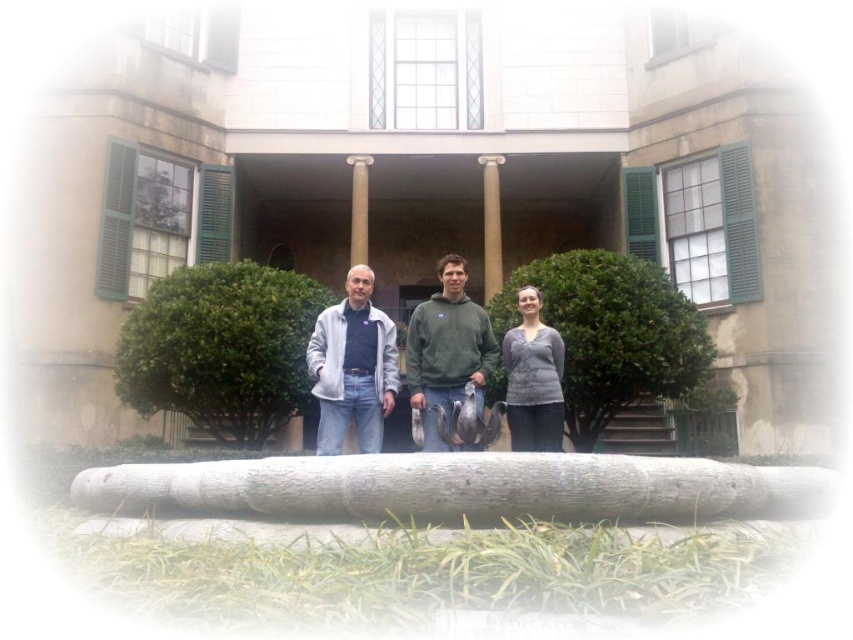
From the picture: You are standing in front of the two story classical building. You see a matte gray hoodie at center and a smooth tan column at center. Which object is closer to the ground?

The matte gray hoodie at center is below the smooth tan column at center, so the matte gray hoodie at center is closer to the ground.

You are a photographer setting up a shoot in front of the classical building. You have two subjects wearing the light gray fleece jacket at center and the gray matte sweater at center. To ensure both are visible in the photo, which clothing item should be moved forward to avoid being obscured?

The gray matte sweater at center should be moved forward because the light gray fleece jacket at center is currently in front of it, potentially blocking the view of the sweater.